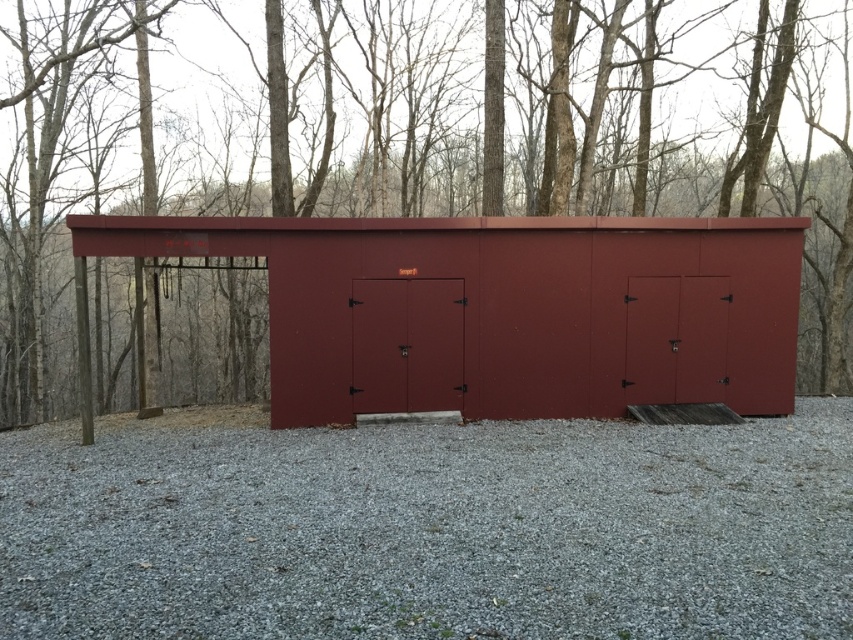
You are standing in front of the maroon structure and want to determine which object, the smooth bark tree at center or the gray gravel at center, is taller. Based on the scene description, which one is taller?

The smooth bark tree at center is much taller than the gray gravel at center according to the description.

You are standing in front of the maroon structure and want to place a small potted plant exactly at the center of the gray gravel at center. According to the coordinates provided, where should you place the plant?

You should place the small potted plant at point (428, 529) on the gray gravel at center.

You are standing in front of the matte red shed at center and want to use it as a reference point to locate the smooth bark tree at center. Based on the scene description, which direction should you look to find the tree?

The smooth bark tree at center is taller than the matte red shed at center, so you should look upward from the matte red shed at center to locate the smooth bark tree at center.